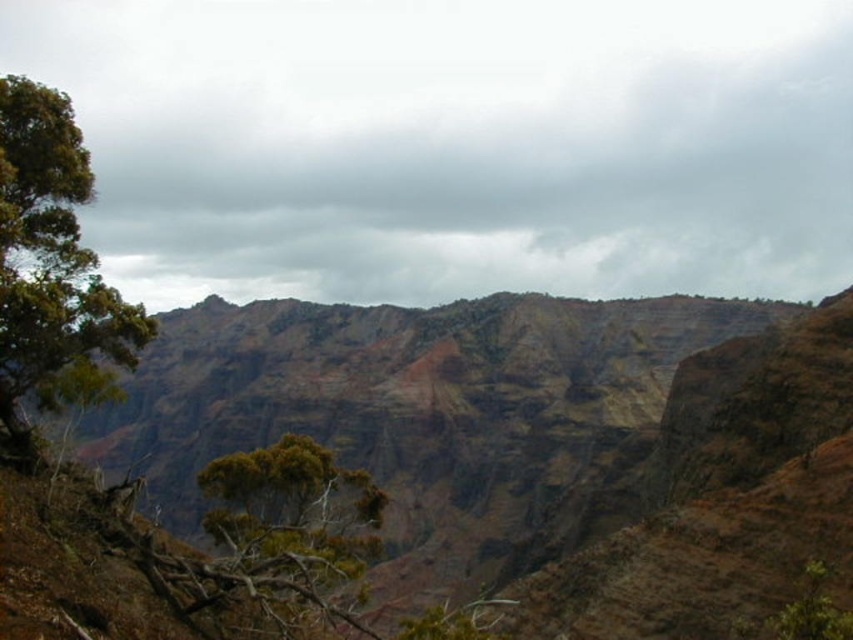
You are a hiker planning to climb the brown rocky mountain at center and the green leafy tree at center. Which one will require more effort to reach the top?

The brown rocky mountain at center is much taller than the green leafy tree at center, so climbing the brown rocky mountain at center will require more effort to reach the top.

You are a hiker looking at the mountain landscape. You notice two green leafy trees in the scene. Which one is positioned higher up the mountain, the green leafy tree at left or the green leafy tree at center?

The green leafy tree at left is positioned higher up the mountain than the green leafy tree at center.